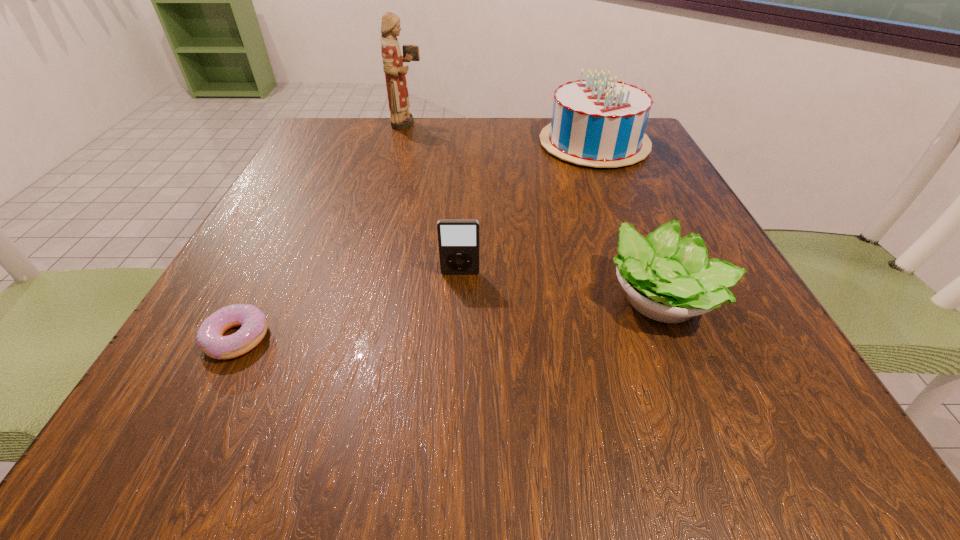
Find the location of a particular element. free space in the image that satisfies the following two spatial constraints: 1. on the front-facing side of the fourth object from right to left; 2. on the back side of the lettuce is located at coordinates (360, 299).